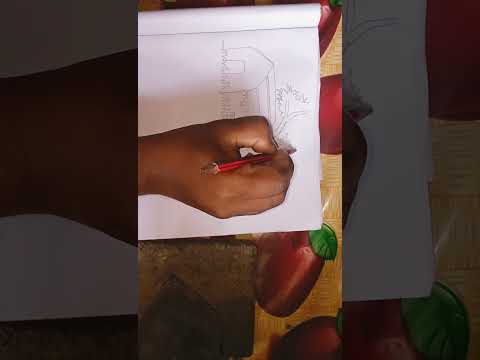
Image resolution: width=480 pixels, height=360 pixels. I want to click on floor, so click(459, 179).